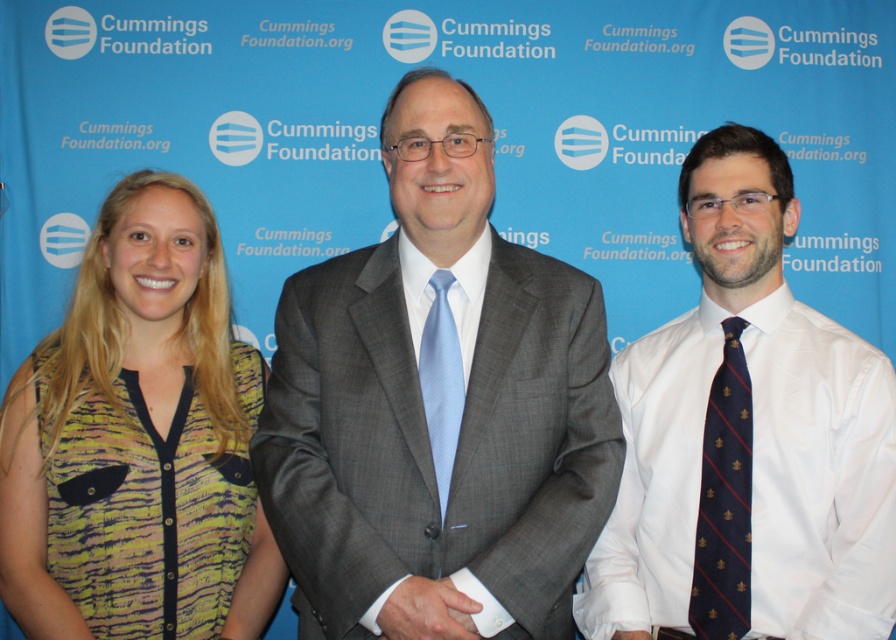
Question: Where is gray textured suit at center located in relation to light blue silk tie at center in the image?

Choices:
 (A) left
 (B) right

Answer: (A)

Question: Which point appears closest to the camera in this image?

Choices:
 (A) (454, 392)
 (B) (748, 435)

Answer: (A)

Question: Which of the following is the farthest from the observer?

Choices:
 (A) [431, 440]
 (B) [33, 611]
 (C) [560, 621]
 (D) [454, 634]

Answer: (B)

Question: Is white satin shirt at center closer to the viewer compared to white satin cuff at center?

Choices:
 (A) no
 (B) yes

Answer: (A)

Question: Where is navy blue silk tie at right located in relation to white satin cuff at center in the image?

Choices:
 (A) left
 (B) right

Answer: (B)

Question: Which object is the farthest from the white satin cuff at center?

Choices:
 (A) light blue silk tie at center
 (B) printed fabric blouse at left
 (C) white satin shirt at center
 (D) navy blue silk tie at right

Answer: (B)